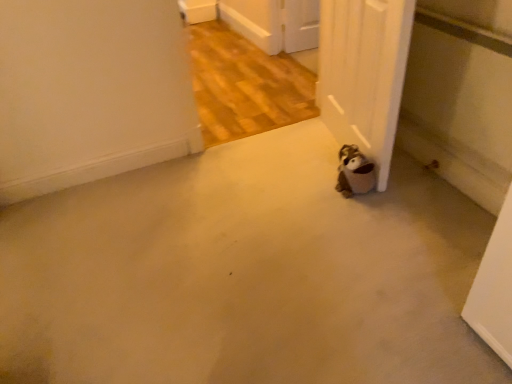
Identify the location of free space behind brown plush toy at lower right. This screenshot has width=512, height=384. (325, 166).